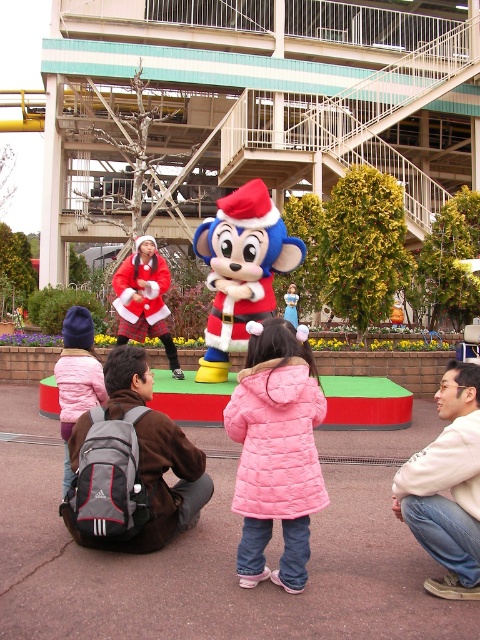
The image size is (480, 640). What do you see at coordinates (447, 486) in the screenshot? I see `light beige sweater at lower right` at bounding box center [447, 486].

Can you confirm if light beige sweater at lower right is positioned to the left of velvet plush monkey at center?

Incorrect, light beige sweater at lower right is not on the left side of velvet plush monkey at center.

This screenshot has width=480, height=640. What are the coordinates of `light beige sweater at lower right` in the screenshot? It's located at (447, 486).

Is light beige sweater at lower right below matte pink coat at lower left?

Indeed, light beige sweater at lower right is positioned under matte pink coat at lower left.

Is point (464, 381) closer to camera compared to point (69, 468)?

Yes, it is in front of point (69, 468).

Which is behind, point (425, 529) or point (84, 387)?

The point (84, 387) is more distant.

This screenshot has width=480, height=640. In order to click on light beige sweater at lower right in this screenshot , I will do `click(447, 486)`.

Which is below, pink quilted coat at center or light beige sweater at lower right?

Positioned lower is light beige sweater at lower right.

Based on the photo, between pink quilted coat at center and light beige sweater at lower right, which one has less height?

light beige sweater at lower right

Who is more forward, (238, 488) or (464, 515)?

Point (464, 515) is in front.

Find the location of a particular element. pink quilted coat at center is located at coordinates (276, 451).